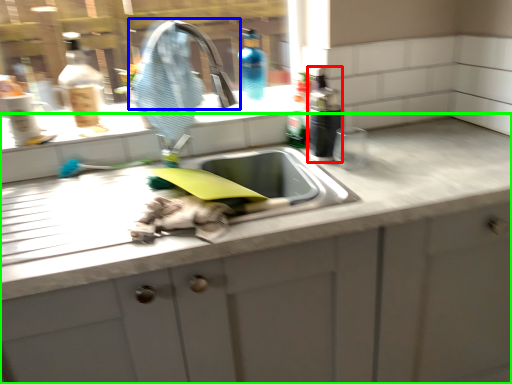
Question: Which is nearer to the bottle (highlighted by a red box)? tap (highlighted by a blue box) or countertop (highlighted by a green box).

Choices:
 (A) tap
 (B) countertop

Answer: (A)